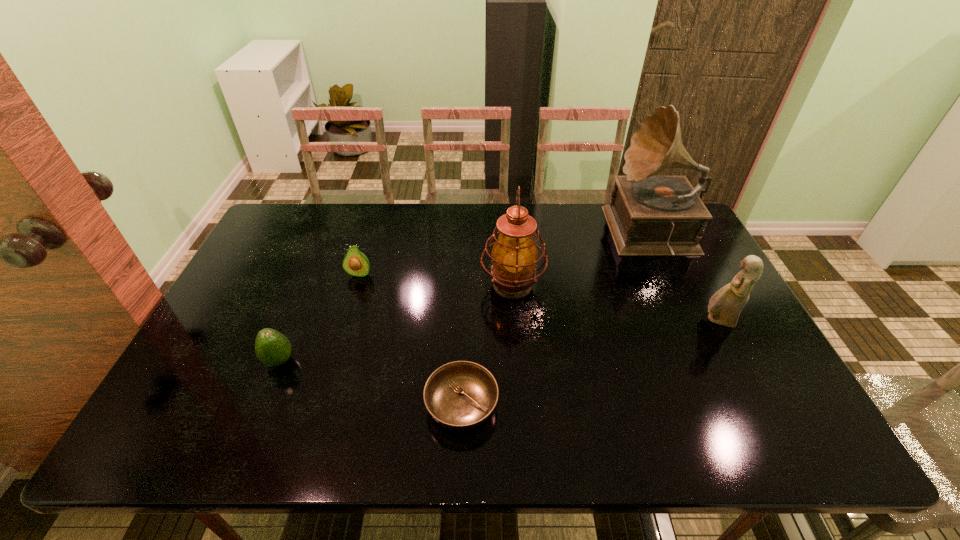
Identify the location of record player. The height and width of the screenshot is (540, 960). (648, 215).

You are a GUI agent. You are given a task and a screenshot of the screen. Output one action in this format:
    pyautogui.click(x=<x>, y=<y>)
    Task: Click on the oil lamp
    
    Given the screenshot: What is the action you would take?
    pyautogui.click(x=514, y=256)

This screenshot has width=960, height=540. I want to click on the third nearest object, so click(x=725, y=306).

You are a GUI agent. You are given a task and a screenshot of the screen. Output one action in this format:
    pyautogui.click(x=<x>, y=<y>)
    Task: Click on the figurine
    
    Given the screenshot: What is the action you would take?
    pyautogui.click(x=725, y=306)

You are a GUI agent. You are given a task and a screenshot of the screen. Output one action in this format:
    pyautogui.click(x=<x>, y=<y>)
    Task: Click on the fifth object from right to left
    This screenshot has width=960, height=540.
    Given the screenshot: What is the action you would take?
    pyautogui.click(x=355, y=263)

Where is `the farther avocado`? The image size is (960, 540). the farther avocado is located at coordinates (355, 263).

In order to click on the fifth farthest object in this screenshot , I will do click(x=272, y=348).

Identify the location of the leftmost object. This screenshot has height=540, width=960. (272, 348).

This screenshot has width=960, height=540. In order to click on soup bowl in this screenshot , I will do `click(461, 395)`.

Where is `the nearest object`? The height and width of the screenshot is (540, 960). the nearest object is located at coordinates (461, 395).